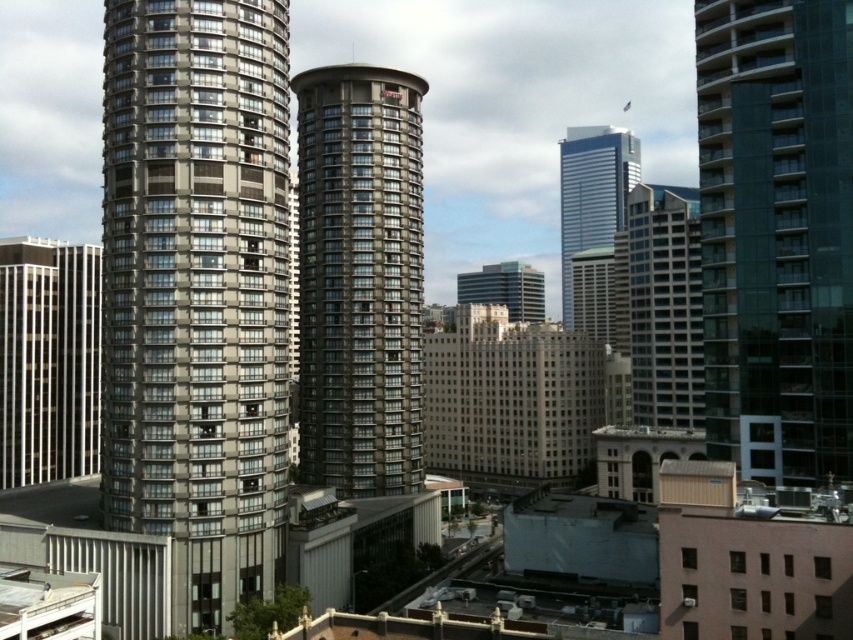
Question: Does gray glassy building at center appear under white glossy building at left?

Choices:
 (A) no
 (B) yes

Answer: (A)

Question: Which object is the farthest from the gray glassy building at center?

Choices:
 (A) gray glass building at left
 (B) glassy teal skyscraper at right

Answer: (B)

Question: Among these objects, which one is farthest from the camera?

Choices:
 (A) gray glass building at center
 (B) gray glassy building at center

Answer: (A)

Question: Is glassy teal skyscraper at right positioned before glassy gray skyscraper at center?

Choices:
 (A) no
 (B) yes

Answer: (B)

Question: Does gray glass building at left have a larger size compared to shiny glass skyscraper at center?

Choices:
 (A) yes
 (B) no

Answer: (B)

Question: Which object is positioned closest to the gray glassy building at center?

Choices:
 (A) glassy gray skyscraper at center
 (B) gray glass building at center
 (C) glassy teal skyscraper at right
 (D) gray glass building at left

Answer: (D)